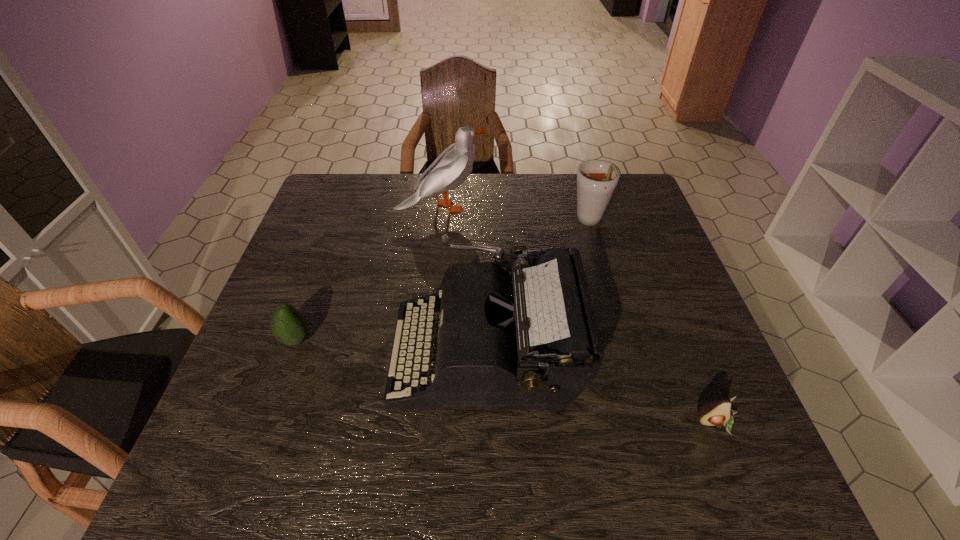
Find the location of `vacant area situated 0.310m on the front-facing side of the typewriter`. vacant area situated 0.310m on the front-facing side of the typewriter is located at coordinates (253, 353).

This screenshot has height=540, width=960. I want to click on free space located on the front-facing side of the typewriter, so click(372, 353).

The image size is (960, 540). I want to click on free space located on the back of the leftmost object, so click(x=338, y=225).

At what (x,y) coordinates should I click in order to perform the action: click on gull at the far edge. Please return your answer as a coordinate pair (x, y). The width and height of the screenshot is (960, 540). Looking at the image, I should click on (452, 167).

At what (x,y) coordinates should I click in order to perform the action: click on root beer that is at the far edge. Please return your answer as a coordinate pair (x, y). The width and height of the screenshot is (960, 540). Looking at the image, I should click on (596, 179).

In order to click on object situated at the left edge in this screenshot , I will do `click(288, 325)`.

At what (x,y) coordinates should I click in order to perform the action: click on root beer situated at the right edge. Please return your answer as a coordinate pair (x, y). Looking at the image, I should click on (596, 179).

Where is `avocado that is at the right edge`? avocado that is at the right edge is located at coordinates (718, 412).

At what (x,y) coordinates should I click in order to perform the action: click on object at the far right corner. Please return your answer as a coordinate pair (x, y). Looking at the image, I should click on (596, 179).

I want to click on vacant space at the far edge of the desktop, so click(404, 210).